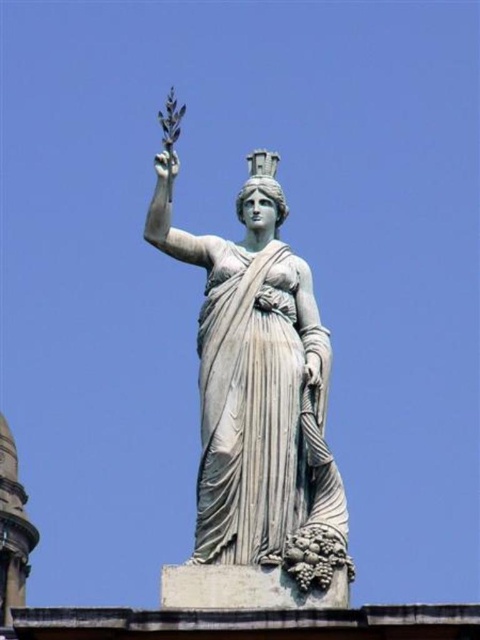
Question: Is white marble statue at center wider than matte gray hand at center?

Choices:
 (A) no
 (B) yes

Answer: (B)

Question: In this image, where is white marble statue at center located relative to white marble hand at upper left?

Choices:
 (A) right
 (B) left

Answer: (A)

Question: Estimate the real-world distances between objects in this image. Which object is farther from the matte gray hand at center?

Choices:
 (A) white marble hand at upper left
 (B) white marble statue at center

Answer: (A)

Question: Considering the relative positions of white marble statue at center and white marble hand at upper left in the image provided, where is white marble statue at center located with respect to white marble hand at upper left?

Choices:
 (A) left
 (B) right

Answer: (B)

Question: Which object is farther from the camera taking this photo?

Choices:
 (A) white marble statue at center
 (B) matte gray hand at center
 (C) white marble hand at upper left

Answer: (C)

Question: Which object is farther from the camera taking this photo?

Choices:
 (A) white marble statue at center
 (B) white marble hand at upper left
 (C) matte gray hand at center

Answer: (B)